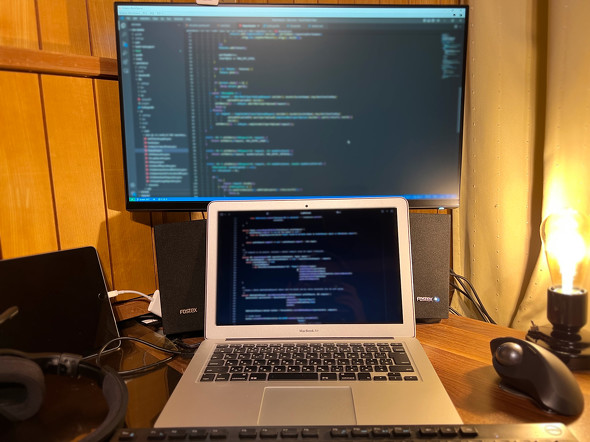
Where is `wires`? wires is located at coordinates (156, 304), (472, 296), (163, 359).